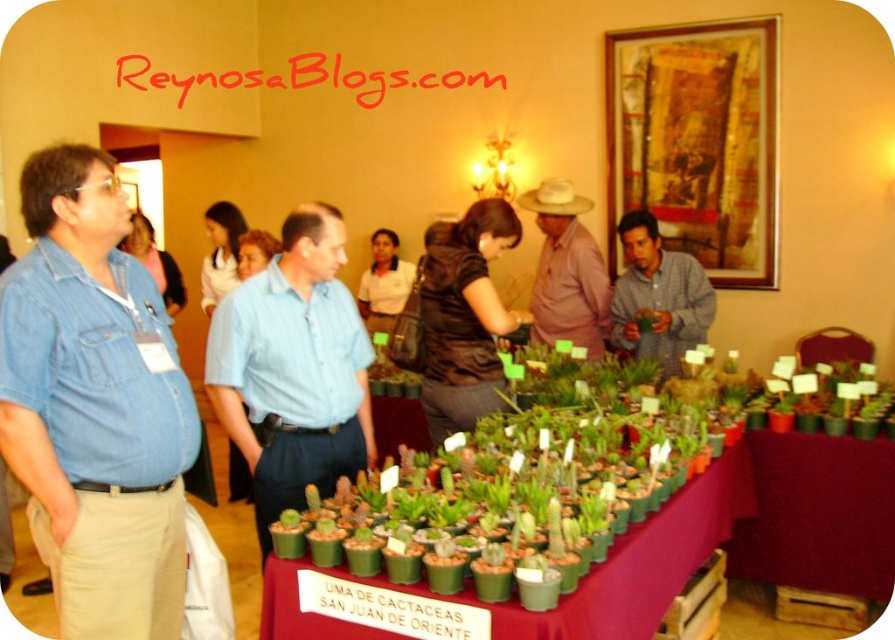
Does point (663, 556) come behind point (708, 314)?

No, it is not.

Who is taller, green plastic pots at center or green matte shirt at center?

green matte shirt at center

Is point (635, 531) closer to viewer compared to point (618, 344)?

Yes, point (635, 531) is in front of point (618, 344).

Locate an element on the screen. This screenshot has height=640, width=895. green plastic pots at center is located at coordinates (578, 580).

Does denim shirt at left appear over pink cotton shirt at center?

Actually, denim shirt at left is below pink cotton shirt at center.

At what (x,y) coordinates should I click in order to perform the action: click on denim shirt at left. Please return your answer as a coordinate pair (x, y). The image size is (895, 640). Looking at the image, I should click on (94, 404).

Which is below, light blue shirt at center or green plastic pots at center?

green plastic pots at center is lower down.

Measure the distance between light blue shirt at center and green plastic pots at center.

light blue shirt at center and green plastic pots at center are 31.71 inches apart.

This screenshot has width=895, height=640. In order to click on light blue shirt at center in this screenshot , I will do `click(293, 369)`.